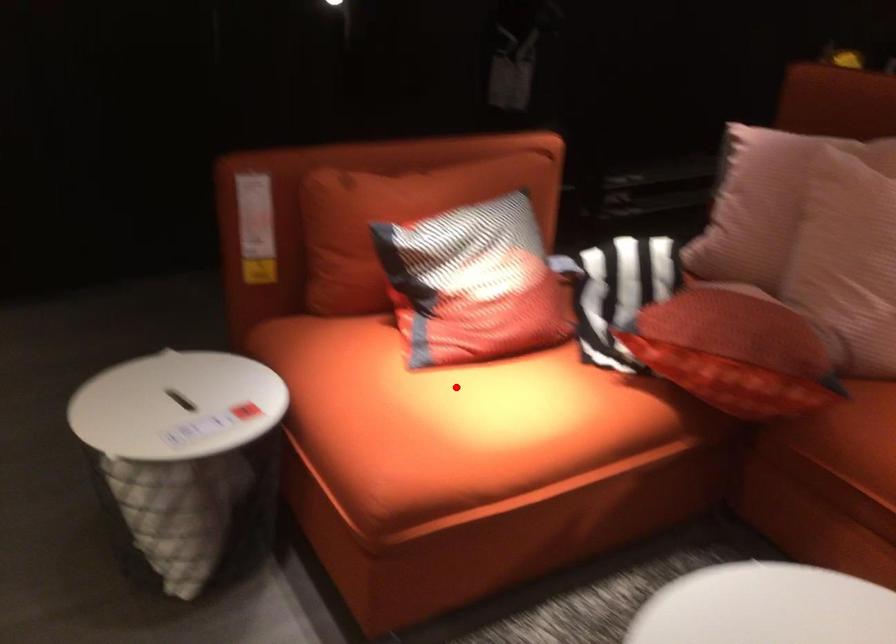
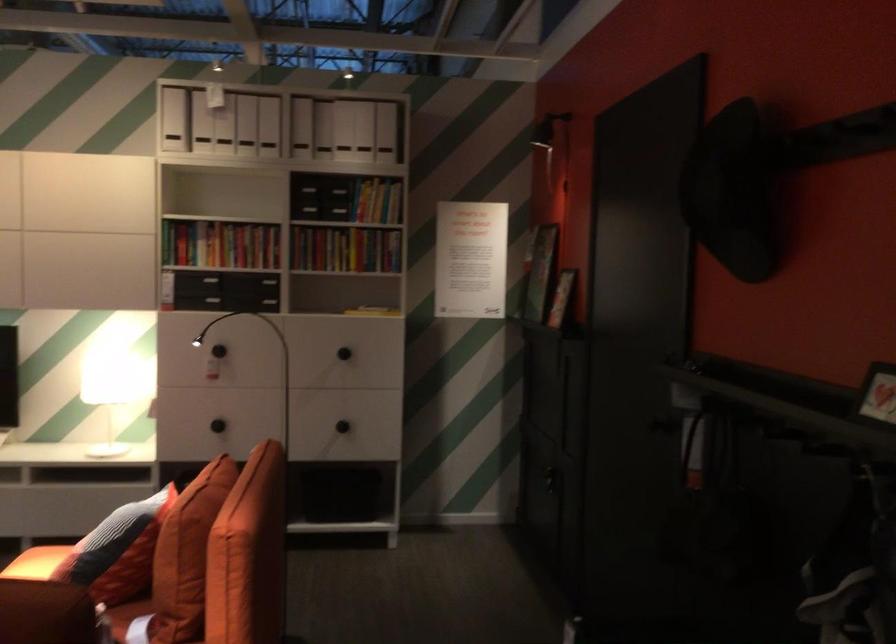
Question: I am providing you with two images of the same scene from different viewpoints. In image1, a red point is highlighted. Considering the same 3D point in image2, which of the following is correct?

Choices:
 (A) It is closer
 (B) It is farther

Answer: (B)